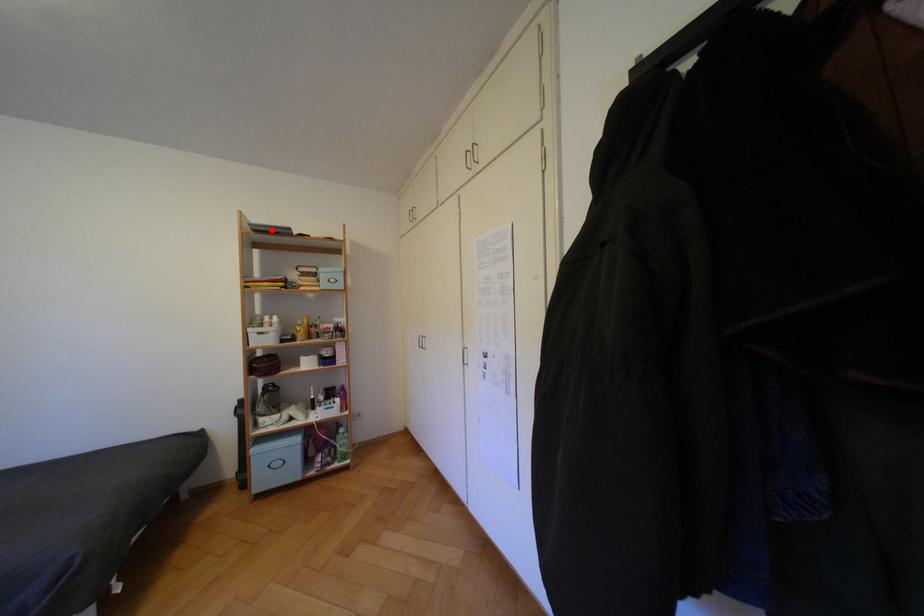
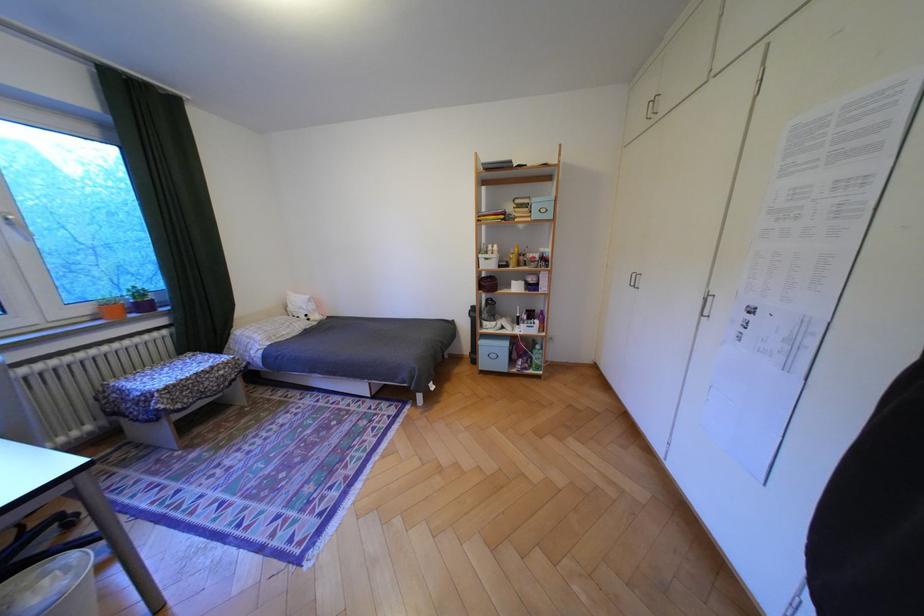
Question: A red point is marked in image1. In image2, is the corresponding 3D point closer to the camera or farther? Reply with the corresponding letter.

Choices:
 (A) The corresponding 3D point is closer.
 (B) The corresponding 3D point is farther.

Answer: (A)